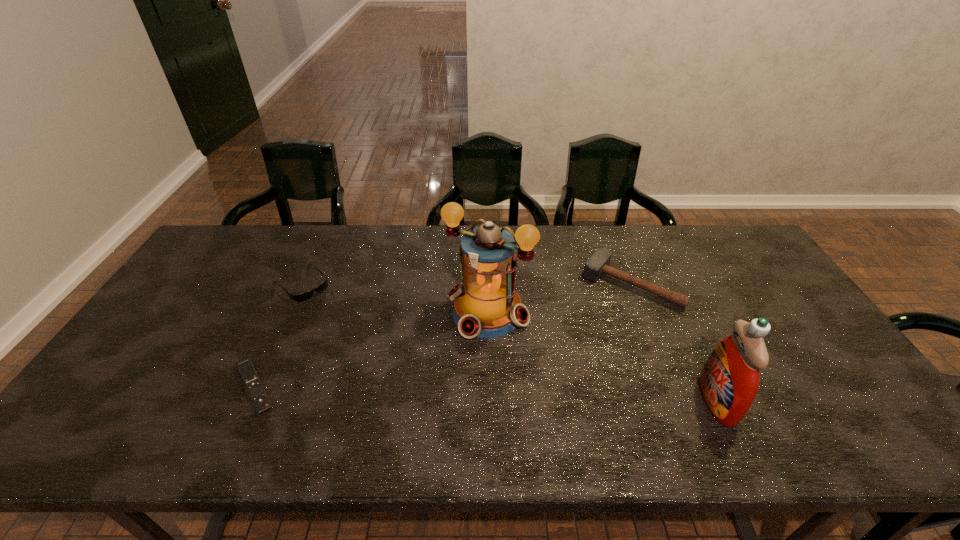
What are the coordinates of `hammer located at the far edge` in the screenshot? It's located at (598, 264).

Locate an element on the screen. remote control that is at the near edge is located at coordinates (252, 382).

This screenshot has width=960, height=540. I want to click on detergent that is at the near edge, so click(729, 381).

The image size is (960, 540). I want to click on vacant space at the far edge of the desktop, so click(293, 240).

Locate an element on the screen. free space at the near edge is located at coordinates (215, 392).

This screenshot has height=540, width=960. In the image, there is a desktop. In order to click on vacant area at the right edge in this screenshot , I will do `click(795, 329)`.

Where is `unoccupied position between the lantern and the second shortest object`? This screenshot has width=960, height=540. unoccupied position between the lantern and the second shortest object is located at coordinates (395, 298).

Locate an element on the screen. The height and width of the screenshot is (540, 960). free space between the second tallest object and the remote control is located at coordinates (486, 394).

The height and width of the screenshot is (540, 960). In order to click on free area in between the detergent and the shortest object in this screenshot , I will do `click(486, 394)`.

Where is `free space between the fourth tallest object and the remote control`? The height and width of the screenshot is (540, 960). free space between the fourth tallest object and the remote control is located at coordinates (278, 335).